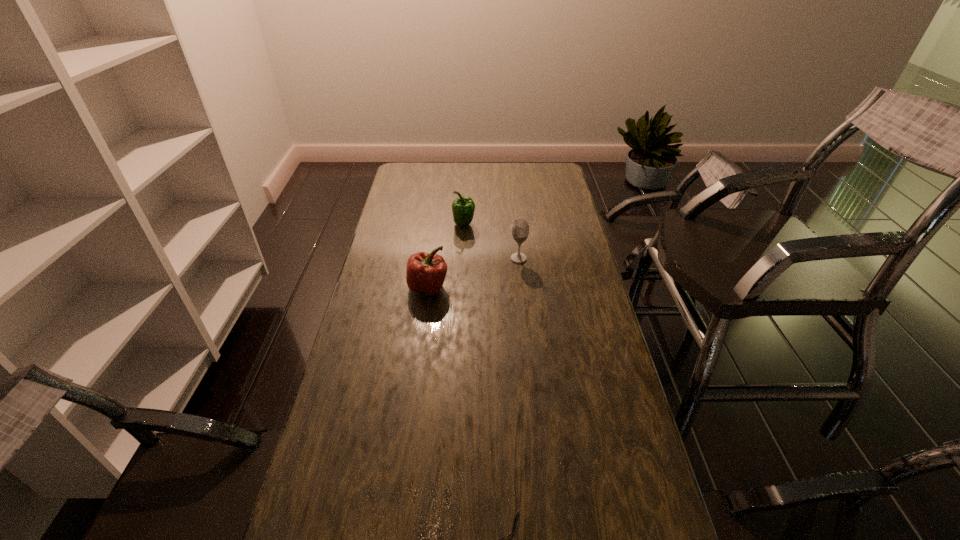
Locate an element on the screen. Image resolution: width=960 pixels, height=540 pixels. blank space at the right edge of the desktop is located at coordinates (562, 315).

Locate an element on the screen. free space at the far left corner of the desktop is located at coordinates (400, 181).

Locate an element on the screen. free space between the nearer bell pepper and the farthest object is located at coordinates (446, 255).

This screenshot has height=540, width=960. In order to click on free space between the second nearest object and the farther bell pepper in this screenshot , I will do (446, 255).

Locate an element on the screen. This screenshot has width=960, height=540. unoccupied area between the farther bell pepper and the nearer bell pepper is located at coordinates (446, 255).

At what (x,y) coordinates should I click in order to perform the action: click on free space between the rightmost object and the farthest object. Please return your answer as a coordinate pair (x, y). This screenshot has height=540, width=960. Looking at the image, I should click on (492, 241).

Find the location of a particular element. free spot between the wineglass and the farther bell pepper is located at coordinates click(x=492, y=241).

You are a GUI agent. You are given a task and a screenshot of the screen. Output one action in this format:
    pyautogui.click(x=<x>, y=<y>)
    Task: Click on the free spot between the nearer bell pepper and the farthest object
    
    Given the screenshot: What is the action you would take?
    [x=446, y=255]

Select which object is the second closest to the farthest object. Please provide its 2D coordinates. Your answer should be formatted as a tuple, i.e. [(x, y)], where the tuple contains the x and y coordinates of a point satisfying the conditions above.

[(426, 272)]

Image resolution: width=960 pixels, height=540 pixels. I want to click on object that is the third nearest to the nearer bell pepper, so click(x=518, y=510).